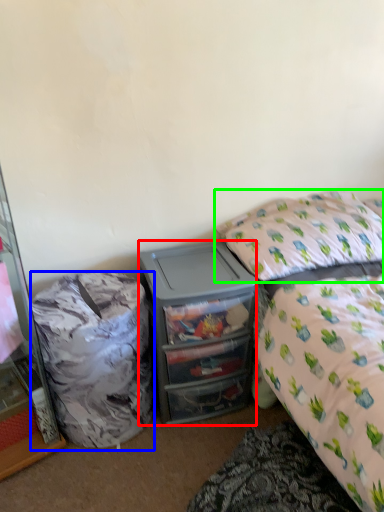
Question: Which object is the closest to the desk (highlighted by a red box)? Choose among these: trash bin/can (highlighted by a blue box) or pillow (highlighted by a green box).

Choices:
 (A) trash bin/can
 (B) pillow

Answer: (A)